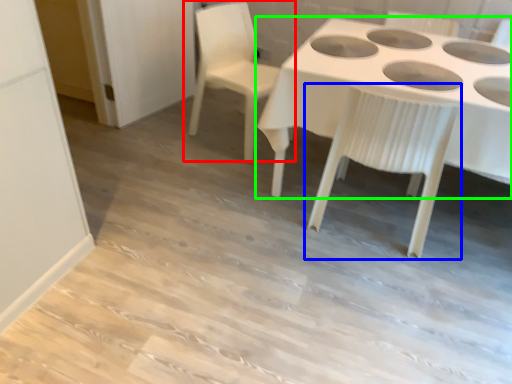
Question: Based on their relative distances, which object is farther from chair (highlighted by a red box)? Choose from chair (highlighted by a blue box) and table (highlighted by a green box).

Choices:
 (A) chair
 (B) table

Answer: (A)